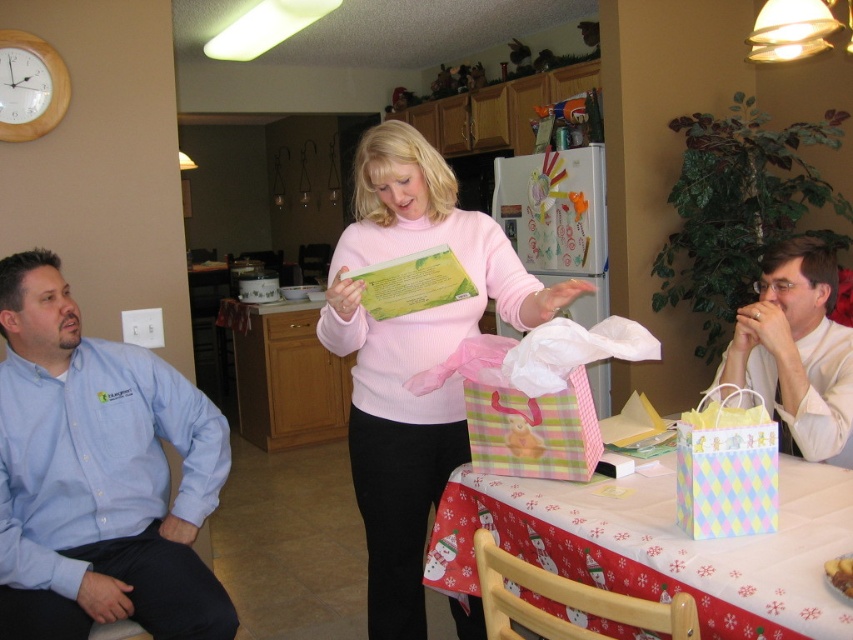
You are a guest at the party and want to reach the yellow matte cake at center to take a slice. However, you are currently standing next to the blue cotton shirt at left. Can you directly access the cake without moving around the shirt?

The yellow matte cake at center is behind the blue cotton shirt at left, so you cannot directly access the cake without moving around the blue cotton shirt at left.

You are organizing a holiday gift exchange and need to place a gift under the table. The table is located at the center of the room. Where should you place the gift so it is closest to the blue cotton shirt at left?

Place the gift near the blue cotton shirt at left, which is located at point (x=97, y=476), to ensure it is closest to that location.